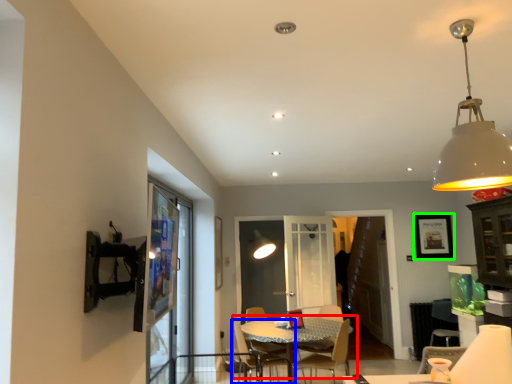
Question: Which is farther away from table (highlighted by a red box)? chair (highlighted by a blue box) or picture frame (highlighted by a green box)?

Choices:
 (A) chair
 (B) picture frame

Answer: (B)